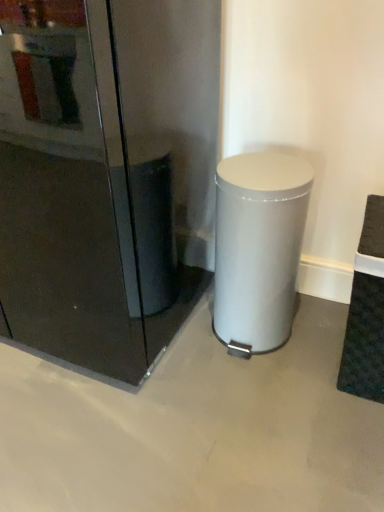
You are a GUI agent. You are given a task and a screenshot of the screen. Output one action in this format:
    pyautogui.click(x=<x>, y=<y>)
    Task: Click on the satin silver trash can at center
    Image resolution: width=384 pixels, height=512 pixels.
    Given the screenshot: What is the action you would take?
    [258, 247]

The height and width of the screenshot is (512, 384). What do you see at coordinates (258, 247) in the screenshot?
I see `satin silver trash can at center` at bounding box center [258, 247].

Measure the distance between satin silver trash can at center and camera.

The depth of satin silver trash can at center is 1.16 meters.

Locate an element on the screen. The width and height of the screenshot is (384, 512). glossy black fridge at center is located at coordinates (106, 175).

What do you see at coordinates (106, 175) in the screenshot?
I see `glossy black fridge at center` at bounding box center [106, 175].

Identify the location of satin silver trash can at center. (258, 247).

Is satin silver trash can at center to the left or to the right of glossy black fridge at center in the image?

From the image, it's evident that satin silver trash can at center is to the right of glossy black fridge at center.

Is satin silver trash can at center in front of or behind glossy black fridge at center in the image?

Clearly, satin silver trash can at center is behind glossy black fridge at center.

Which is behind, point (282, 240) or point (157, 36)?

Point (157, 36)

From the image's perspective, is satin silver trash can at center located above glossy black fridge at center?

No.

From a real-world perspective, is satin silver trash can at center above or below glossy black fridge at center?

In terms of real-world spatial position, satin silver trash can at center is below glossy black fridge at center.

Is satin silver trash can at center thinner than glossy black fridge at center?

Yes.

Which of these two, satin silver trash can at center or glossy black fridge at center, stands shorter?

Standing shorter between the two is satin silver trash can at center.

Looking at the image, does satin silver trash can at center seem bigger or smaller compared to glossy black fridge at center?

satin silver trash can at center is smaller than glossy black fridge at center.

Consider the image. Choose the correct answer: Is satin silver trash can at center inside glossy black fridge at center or outside it?

The correct answer is: outside.

In the scene shown: Is there a large distance between satin silver trash can at center and glossy black fridge at center?

Actually, satin silver trash can at center and glossy black fridge at center are a little close together.

Is satin silver trash can at center facing towards glossy black fridge at center?

No, satin silver trash can at center is not aimed at glossy black fridge at center.

How different are the orientations of satin silver trash can at center and glossy black fridge at center in degrees?

The angle between the facing direction of satin silver trash can at center and the facing direction of glossy black fridge at center is 0.858 degrees.

In the image, there is a satin silver trash can at center. Identify the location of fridge above it (from the image's perspective). (106, 175).

Considering the positions of objects glossy black fridge at center and satin silver trash can at center in the image provided, who is more to the left, glossy black fridge at center or satin silver trash can at center?

Positioned to the left is glossy black fridge at center.

Looking at this image, is glossy black fridge at center in front of or behind satin silver trash can at center in the image?

glossy black fridge at center is positioned closer to the viewer than satin silver trash can at center.

Is point (62, 177) in front of point (263, 334)?

That is True.

From the picture: From the image's perspective, is glossy black fridge at center located above or below satin silver trash can at center?

glossy black fridge at center is above satin silver trash can at center.

From a real-world perspective, which is physically above, glossy black fridge at center or satin silver trash can at center?

glossy black fridge at center.

Which of these two, glossy black fridge at center or satin silver trash can at center, is wider?

With larger width is glossy black fridge at center.

Who is taller, glossy black fridge at center or satin silver trash can at center?

glossy black fridge at center is taller.

Between glossy black fridge at center and satin silver trash can at center, which one has larger size?

Bigger between the two is glossy black fridge at center.

Would you say glossy black fridge at center is outside satin silver trash can at center?

Absolutely, glossy black fridge at center is external to satin silver trash can at center.

Are glossy black fridge at center and satin silver trash can at center located far from each other?

No, there isn't a large distance between glossy black fridge at center and satin silver trash can at center.

Is satin silver trash can at center at the back of glossy black fridge at center?

No, glossy black fridge at center is not facing the opposite direction of satin silver trash can at center.

How much distance is there between glossy black fridge at center and satin silver trash can at center?

glossy black fridge at center and satin silver trash can at center are 14.72 inches apart.

Identify the location of waste container below the glossy black fridge at center (from a real-world perspective). This screenshot has width=384, height=512. (258, 247).

The image size is (384, 512). I want to click on waste container below the glossy black fridge at center (from a real-world perspective), so click(258, 247).

Locate an element on the screen. fridge above the satin silver trash can at center (from a real-world perspective) is located at coordinates (106, 175).